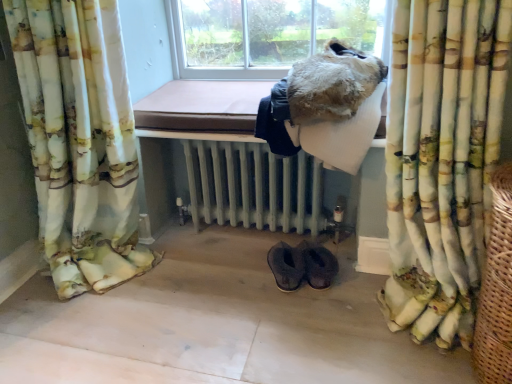
Question: Is white painted radiator at center shorter than brown suede slippers at lower center?

Choices:
 (A) yes
 (B) no

Answer: (B)

Question: From the image's perspective, would you say white painted radiator at center is shown under brown suede slippers at lower center?

Choices:
 (A) yes
 (B) no

Answer: (B)

Question: Is white painted radiator at center looking in the opposite direction of brown suede slippers at lower center?

Choices:
 (A) no
 (B) yes

Answer: (A)

Question: Is white painted radiator at center in front of brown suede slippers at lower center?

Choices:
 (A) yes
 (B) no

Answer: (B)

Question: Is white painted radiator at center facing towards brown suede slippers at lower center?

Choices:
 (A) no
 (B) yes

Answer: (A)

Question: In terms of width, does woven brown basket at right look wider or thinner when compared to brown suede slippers at lower center?

Choices:
 (A) wide
 (B) thin

Answer: (A)

Question: From a real-world perspective, is woven brown basket at right positioned above or below brown suede slippers at lower center?

Choices:
 (A) above
 (B) below

Answer: (A)

Question: From the image's perspective, is woven brown basket at right positioned above or below brown suede slippers at lower center?

Choices:
 (A) above
 (B) below

Answer: (A)

Question: Based on their sizes in the image, would you say woven brown basket at right is bigger or smaller than brown suede slippers at lower center?

Choices:
 (A) big
 (B) small

Answer: (A)

Question: Relative to floral fabric curtain at left, which appears as the 1th curtain when viewed from the left, is printed fabric curtain at right, acting as the 2th curtain starting from the left, in front or behind?

Choices:
 (A) front
 (B) behind

Answer: (A)

Question: Do you think printed fabric curtain at right, acting as the 2th curtain starting from the left, is within floral fabric curtain at left, the 2th curtain in the right-to-left sequence, or outside of it?

Choices:
 (A) inside
 (B) outside

Answer: (B)

Question: Is point (428, 41) closer or farther from the camera than point (65, 253)?

Choices:
 (A) farther
 (B) closer

Answer: (B)

Question: From the image's perspective, is printed fabric curtain at right, acting as the 2th curtain starting from the left, positioned above or below floral fabric curtain at left, which appears as the 1th curtain when viewed from the left?

Choices:
 (A) above
 (B) below

Answer: (B)

Question: Is fuzzy fur coat at upper center in front of or behind printed fabric curtain at right, acting as the 2th curtain starting from the left, in the image?

Choices:
 (A) behind
 (B) front

Answer: (A)

Question: From a real-world perspective, relative to printed fabric curtain at right, acting as the 2th curtain starting from the left, is fuzzy fur coat at upper center vertically above or below?

Choices:
 (A) above
 (B) below

Answer: (A)